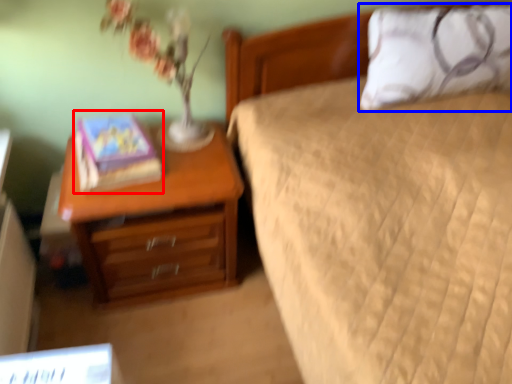
Question: Which object is further to the camera taking this photo, book (highlighted by a red box) or pillow (highlighted by a blue box)?

Choices:
 (A) book
 (B) pillow

Answer: (B)